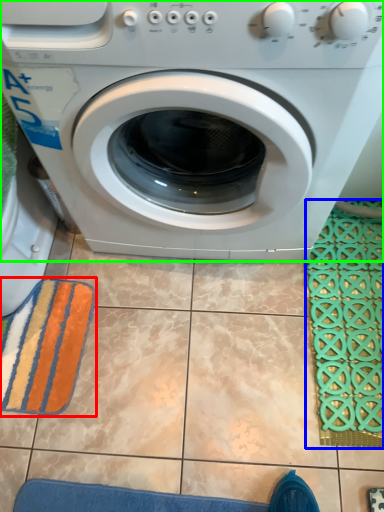
Question: Which object is the farthest from bath towel (highlighted by a red box)? Choose among these: bath mat (highlighted by a blue box) or washing machine (highlighted by a green box).

Choices:
 (A) bath mat
 (B) washing machine

Answer: (A)